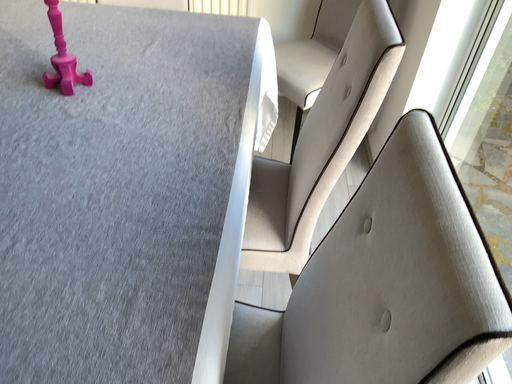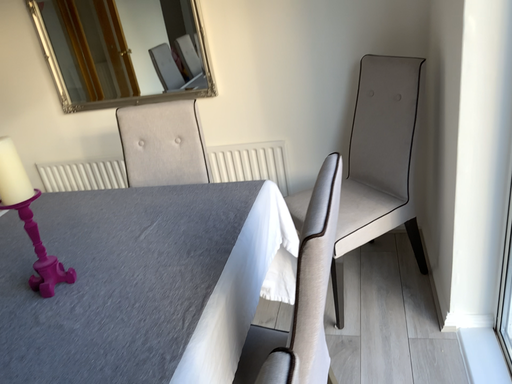
Question: How did the camera likely rotate when shooting the video?

Choices:
 (A) rotated downward
 (B) rotated upward

Answer: (B)